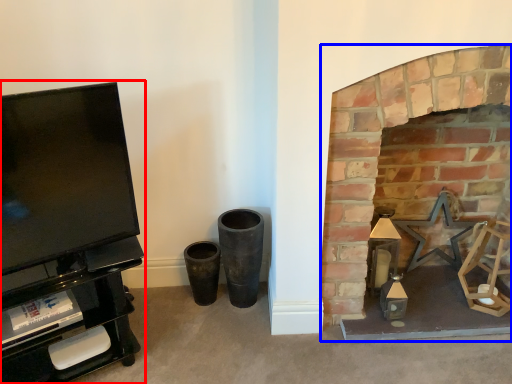
Question: Which point is closer to the camera, entertainment center (highlighted by a red box) or fireplace (highlighted by a blue box)?

Choices:
 (A) entertainment center
 (B) fireplace

Answer: (A)